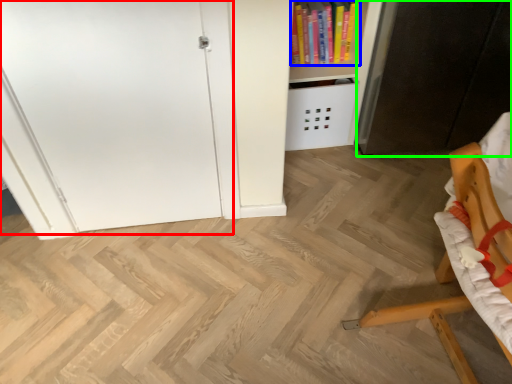
Question: Estimate the real-world distances between objects in this image. Which object is farther from door (highlighted by a red box), book (highlighted by a blue box) or cabinetry (highlighted by a green box)?

Choices:
 (A) book
 (B) cabinetry

Answer: (B)